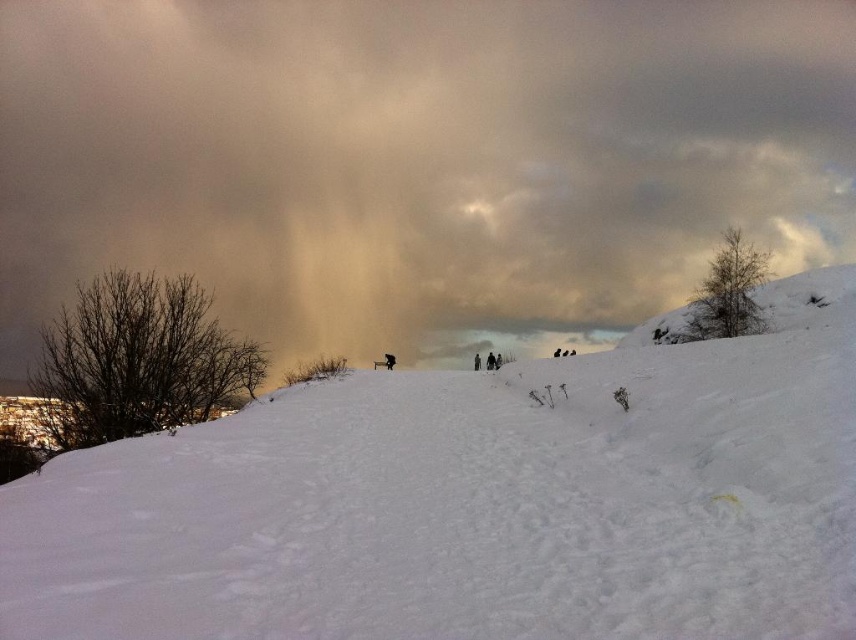
Question: Which point is closer to the camera?

Choices:
 (A) coord(589,257)
 (B) coord(587,522)

Answer: (B)

Question: Is cloudy sky at upper center closer to camera compared to white fluffy snow at center?

Choices:
 (A) yes
 (B) no

Answer: (B)

Question: Does cloudy sky at upper center have a larger size compared to white fluffy snow at center?

Choices:
 (A) no
 (B) yes

Answer: (B)

Question: Does cloudy sky at upper center have a larger size compared to white fluffy snow at center?

Choices:
 (A) yes
 (B) no

Answer: (A)

Question: Among these objects, which one is nearest to the camera?

Choices:
 (A) cloudy sky at upper center
 (B) white fluffy snow at center

Answer: (B)

Question: Which object appears farthest from the camera in this image?

Choices:
 (A) white fluffy snow at center
 (B) cloudy sky at upper center

Answer: (B)